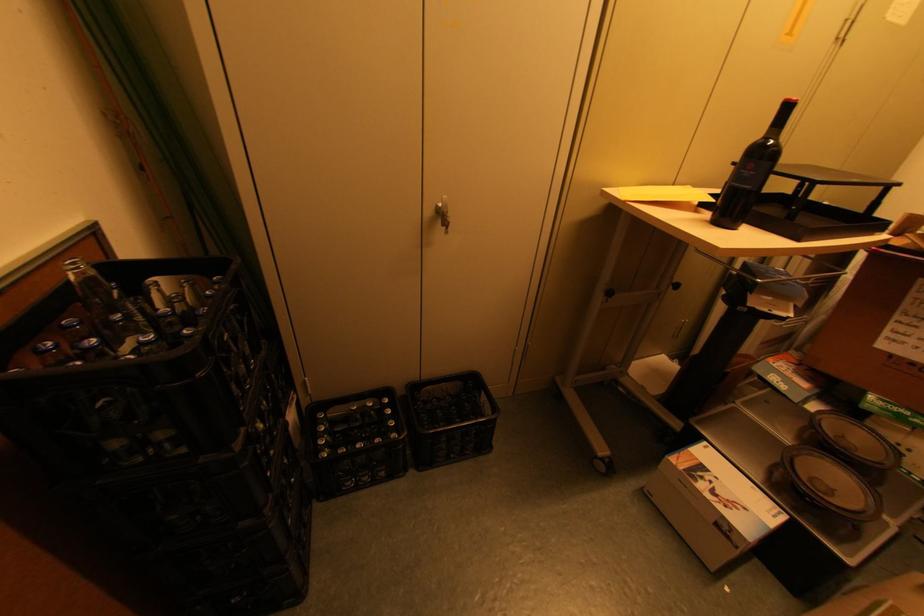
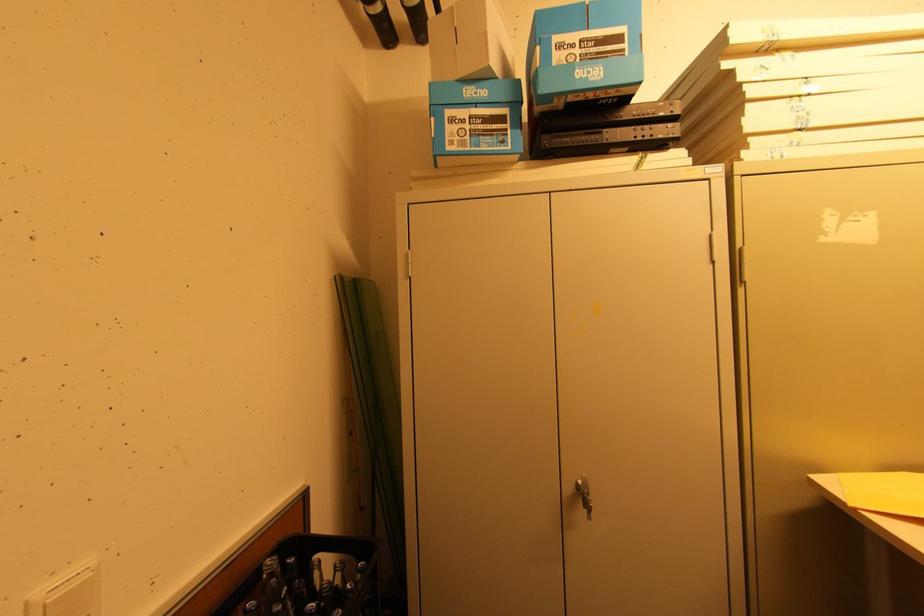
Based on the continuous images, in which direction is the camera rotating?

The rotation direction of the camera is left-up.